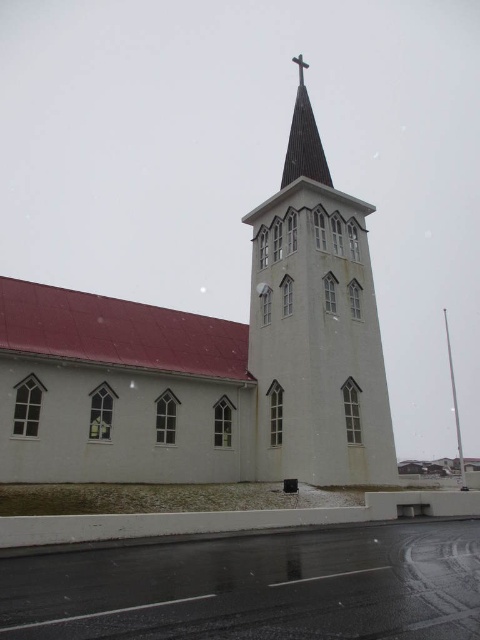
Can you confirm if white matte church at center is positioned to the left of dark brown wood steeple at upper center?

Yes, white matte church at center is to the left of dark brown wood steeple at upper center.

Does point (377, 337) come closer to viewer compared to point (327, 168)?

Yes, it is in front of point (327, 168).

Who is more forward, (63, 372) or (303, 150)?

Point (63, 372)

Image resolution: width=480 pixels, height=640 pixels. I want to click on white matte church at center, so click(208, 369).

Which is below, white matte church at center or metallic cross at upper center?

white matte church at center is lower down.

Find the location of a particular element. This screenshot has width=480, height=640. white matte church at center is located at coordinates (208, 369).

Which is in front, point (333, 346) or point (302, 60)?

Positioned in front is point (333, 346).

In order to click on white matte church at center in this screenshot , I will do `click(208, 369)`.

Can you confirm if white matte church at center is positioned below white smooth steeple at center?

Correct, white matte church at center is located below white smooth steeple at center.

Can you confirm if white matte church at center is wider than white smooth steeple at center?

Yes, white matte church at center is wider than white smooth steeple at center.

The height and width of the screenshot is (640, 480). Describe the element at coordinates (208, 369) in the screenshot. I see `white matte church at center` at that location.

At what (x,y) coordinates should I click in order to perform the action: click on white matte church at center. Please return your answer as a coordinate pair (x, y). Looking at the image, I should click on (208, 369).